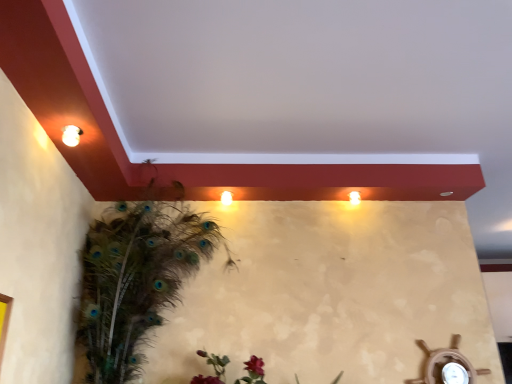
Question: Is feathered peacock at left bigger than matte white light fixture at upper left?

Choices:
 (A) no
 (B) yes

Answer: (B)

Question: Is feathered peacock at left closer to the viewer compared to matte white light fixture at upper left?

Choices:
 (A) no
 (B) yes

Answer: (A)

Question: Is feathered peacock at left turned away from matte white light fixture at upper left?

Choices:
 (A) yes
 (B) no

Answer: (B)

Question: Considering the relative positions of feathered peacock at left and matte white light fixture at upper left in the image provided, is feathered peacock at left behind matte white light fixture at upper left?

Choices:
 (A) yes
 (B) no

Answer: (A)

Question: From the image's perspective, is feathered peacock at left located beneath matte white light fixture at upper left?

Choices:
 (A) no
 (B) yes

Answer: (B)

Question: From a real-world perspective, is feathered peacock at left physically above matte white light fixture at upper left?

Choices:
 (A) no
 (B) yes

Answer: (A)

Question: Does matte white light fixture at upper left come behind matte white light at upper right?

Choices:
 (A) no
 (B) yes

Answer: (A)

Question: From the image's perspective, does matte white light fixture at upper left appear lower than matte white light at upper right?

Choices:
 (A) no
 (B) yes

Answer: (A)

Question: Is matte white light fixture at upper left thinner than matte white light at upper right?

Choices:
 (A) yes
 (B) no

Answer: (A)

Question: Does matte white light fixture at upper left come in front of matte white light at upper right?

Choices:
 (A) no
 (B) yes

Answer: (B)

Question: Considering the relative positions of matte white light fixture at upper left and matte white light at upper right in the image provided, is matte white light fixture at upper left to the left of matte white light at upper right from the viewer's perspective?

Choices:
 (A) yes
 (B) no

Answer: (A)

Question: Can matte white light at upper right be found inside matte white light fixture at upper left?

Choices:
 (A) yes
 (B) no

Answer: (B)

Question: Considering the relative sizes of matte white light at upper right and feathered peacock at left in the image provided, is matte white light at upper right smaller than feathered peacock at left?

Choices:
 (A) yes
 (B) no

Answer: (A)